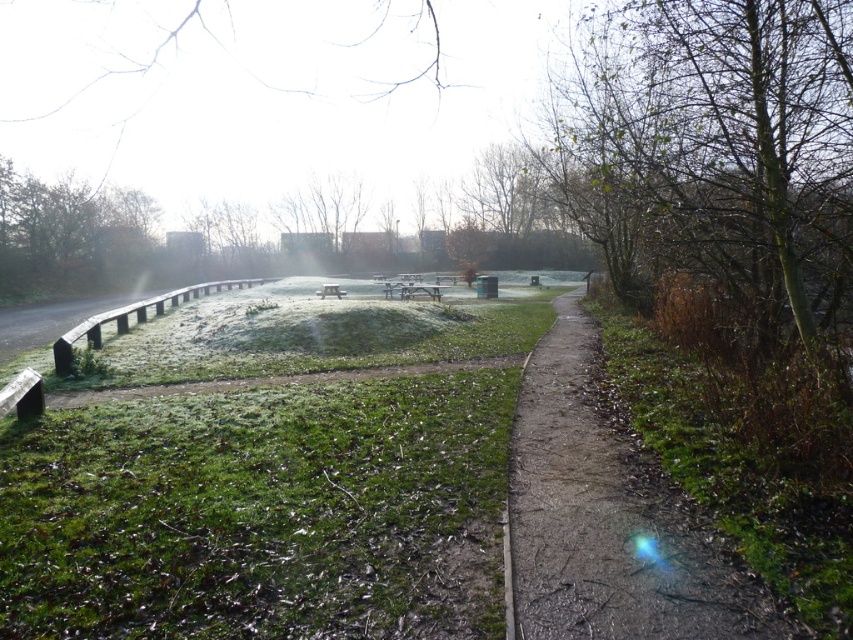
Question: Which point is closer to the camera?

Choices:
 (A) bare branches at right
 (B) wooden picnic table at center
 (C) green leafy tree at upper left
 (D) dull brown dirt path at right

Answer: (D)

Question: Which point is farther to the camera?

Choices:
 (A) (3, 214)
 (B) (810, 97)
 (C) (712, 566)
 (D) (323, 288)

Answer: (A)

Question: Does bare branches at right appear over dull brown dirt path at right?

Choices:
 (A) no
 (B) yes

Answer: (B)

Question: Is dull brown dirt path at right below wooden picnic table at center?

Choices:
 (A) yes
 (B) no

Answer: (A)

Question: Does bare branches at right appear on the right side of green leafy tree at upper left?

Choices:
 (A) no
 (B) yes

Answer: (B)

Question: Among these objects, which one is farthest from the camera?

Choices:
 (A) wooden picnic table at center
 (B) dull brown dirt path at right
 (C) bare branches at right

Answer: (A)